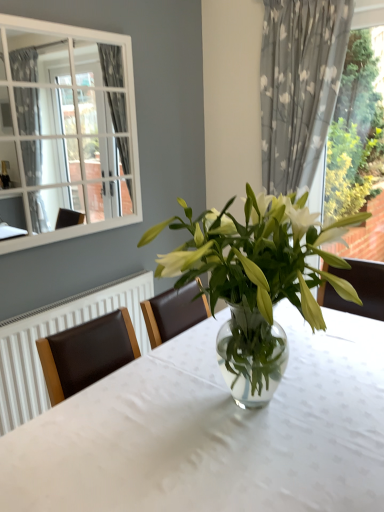
Question: From the image's perspective, relative to gray floral fabric curtain at right, is transparent glass vase at center above or below?

Choices:
 (A) above
 (B) below

Answer: (B)

Question: In the image, is transparent glass vase at center positioned in front of or behind gray floral fabric curtain at right?

Choices:
 (A) behind
 (B) front

Answer: (B)

Question: Which of these objects is positioned closest to the gray floral fabric curtain at right?

Choices:
 (A) transparent glass vase at center
 (B) green leafy plant at right
 (C) clear glass vase at center

Answer: (B)

Question: Estimate the real-world distances between objects in this image. Which object is closer to the transparent glass vase at center?

Choices:
 (A) gray floral fabric curtain at right
 (B) clear glass vase at center
 (C) green leafy plant at right

Answer: (B)